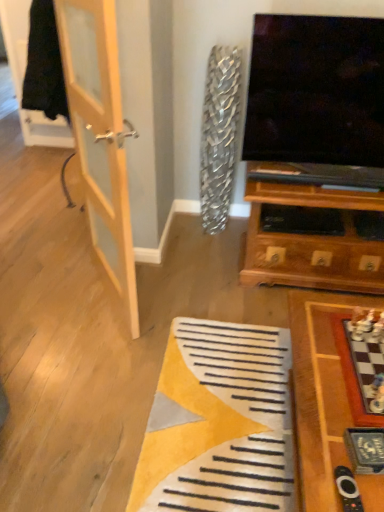
What do you see at coordinates (320, 392) in the screenshot?
I see `wooden chessboard at lower right` at bounding box center [320, 392].

You are a GUI agent. You are given a task and a screenshot of the screen. Output one action in this format:
    pyautogui.click(x=<x>, y=<y>)
    Task: Click on the wooden chessboard at lower right
    This screenshot has height=512, width=384.
    Given the screenshot: What is the action you would take?
    pyautogui.click(x=320, y=392)

At what (x,y) coordinates should I click in order to perform the action: click on black plastic remote at lower right. Please return your answer as a coordinate pair (x, y). Looking at the image, I should click on (347, 490).

In the scene shown: From a real-world perspective, is light wood door at left positioned above or below black plastic remote at lower right?

From a real-world perspective, light wood door at left is physically above black plastic remote at lower right.

Can you confirm if light wood door at left is smaller than black plastic remote at lower right?

Actually, light wood door at left might be larger than black plastic remote at lower right.

Is light wood door at left facing towards black plastic remote at lower right?

No, light wood door at left is not aimed at black plastic remote at lower right.

In terms of height, does wooden chessboard at lower right look taller or shorter compared to light wood door at left?

Considering their sizes, wooden chessboard at lower right has less height than light wood door at left.

Which of these two, wooden chessboard at lower right or light wood door at left, is thinner?

light wood door at left.

The image size is (384, 512). What are the coordinates of `door on the left of the wooden chessboard at lower right` in the screenshot? It's located at (100, 135).

Is point (68, 8) positioned after point (347, 397)?

Yes, it is behind point (347, 397).

Is light wood door at left inside the boundaries of wooden chessboard at lower right, or outside?

light wood door at left is not enclosed by wooden chessboard at lower right.

Is light wood door at left to the left of wooden chessboard at lower right from the viewer's perspective?

Yes.

Which of these two, light wood door at left or wooden chessboard at lower right, is bigger?

wooden chessboard at lower right.

Can you see wooden chessboard at lower right touching black plastic remote at lower right?

No, wooden chessboard at lower right is not beside black plastic remote at lower right.

From a real-world perspective, relative to black plastic remote at lower right, is wooden chessboard at lower right vertically above or below?

From a real-world perspective, wooden chessboard at lower right is physically below black plastic remote at lower right.

In the image, is wooden chessboard at lower right positioned in front of or behind black plastic remote at lower right?

In the image, wooden chessboard at lower right appears behind black plastic remote at lower right.

Where is `remote on the left of wooden chessboard at lower right`? The image size is (384, 512). remote on the left of wooden chessboard at lower right is located at coordinates (347, 490).

Based on the photo, does black plastic remote at lower right lie behind wooden chessboard at lower right?

No.

Considering the sizes of black plastic remote at lower right and wooden chessboard at lower right in the image, is black plastic remote at lower right wider or thinner than wooden chessboard at lower right?

Clearly, black plastic remote at lower right has less width compared to wooden chessboard at lower right.

From the picture: How different are the orientations of black plastic remote at lower right and wooden chessboard at lower right in degrees?

The angle between the facing direction of black plastic remote at lower right and the facing direction of wooden chessboard at lower right is 85.7 degrees.

Locate an element on the screen. The height and width of the screenshot is (512, 384). table on the right of black plastic remote at lower right is located at coordinates (320, 392).

Does black plastic remote at lower right have a larger size compared to light wood door at left?

Actually, black plastic remote at lower right might be smaller than light wood door at left.

Are black plastic remote at lower right and light wood door at left located far from each other?

Indeed, black plastic remote at lower right is not near light wood door at left.

Which object is thinner, black plastic remote at lower right or light wood door at left?

light wood door at left.

Consider the image. Between black plastic remote at lower right and light wood door at left, which one appears on the right side from the viewer's perspective?

From the viewer's perspective, black plastic remote at lower right appears more on the right side.

Find the location of a particular element. door on the left of black plastic remote at lower right is located at coordinates (100, 135).

The width and height of the screenshot is (384, 512). Find the location of `table lying below the light wood door at left (from the image's perspective)`. table lying below the light wood door at left (from the image's perspective) is located at coordinates (320, 392).

Which object lies further to the anchor point black plastic remote at lower right, wooden chessboard at lower right or light wood door at left?

light wood door at left is positioned further to the anchor black plastic remote at lower right.

From the image, which object appears to be nearer to light wood door at left, black plastic remote at lower right or wooden chessboard at lower right?

wooden chessboard at lower right lies closer to light wood door at left than the other object.

When comparing their distances from wooden chessboard at lower right, does black plastic remote at lower right or light wood door at left seem closer?

black plastic remote at lower right is positioned closer to the anchor wooden chessboard at lower right.

From the image, which object appears to be farther from black plastic remote at lower right, light wood door at left or wooden chessboard at lower right?

The object further to black plastic remote at lower right is light wood door at left.

When comparing their distances from wooden chessboard at lower right, does light wood door at left or black plastic remote at lower right seem closer?

black plastic remote at lower right is positioned closer to the anchor wooden chessboard at lower right.

Which object lies nearer to the anchor point light wood door at left, wooden chessboard at lower right or black plastic remote at lower right?

The object closer to light wood door at left is wooden chessboard at lower right.

Identify the location of table between light wood door at left and black plastic remote at lower right vertically. (320, 392).